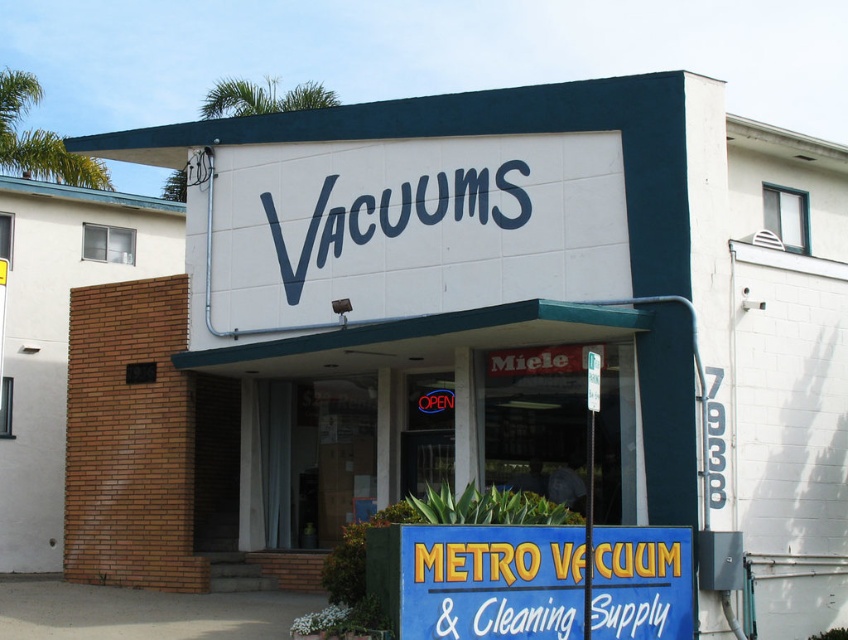
Does blue plastic sign at center have a lesser height compared to white plastic sign at lower center?

In fact, blue plastic sign at center may be taller than white plastic sign at lower center.

Is blue plastic sign at center positioned in front of white plastic sign at lower center?

Yes.

Is point (544, 612) farther from viewer compared to point (556, 609)?

No.

In order to click on blue plastic sign at center in this screenshot , I will do `click(491, 580)`.

Does blue painted sign at center have a lesser height compared to white plastic sign at lower center?

Incorrect, blue painted sign at center's height does not fall short of white plastic sign at lower center's.

Is blue painted sign at center above white plastic sign at lower center?

Yes, blue painted sign at center is above white plastic sign at lower center.

Identify the location of blue painted sign at center. This screenshot has height=640, width=848. (395, 214).

Can you confirm if blue plastic sign at center is smaller than blue painted sign at center?

Yes.

Between blue plastic sign at center and blue painted sign at center, which one has more height?

blue painted sign at center

What do you see at coordinates (491, 580) in the screenshot?
I see `blue plastic sign at center` at bounding box center [491, 580].

Find the location of a particular element. blue plastic sign at center is located at coordinates (491, 580).